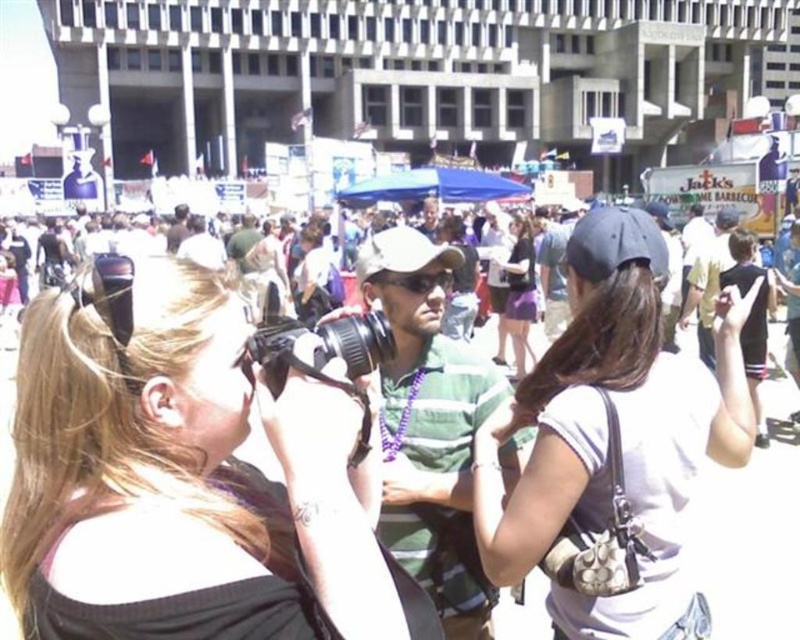
You are a photographer trying to capture the crowd at this event. You notice the white matte baseball cap at center and the matte black camera at center. Which object is blocking your view of the other?

The white matte baseball cap at center is positioned over the matte black camera at center, so the hat is blocking the view of the camera.